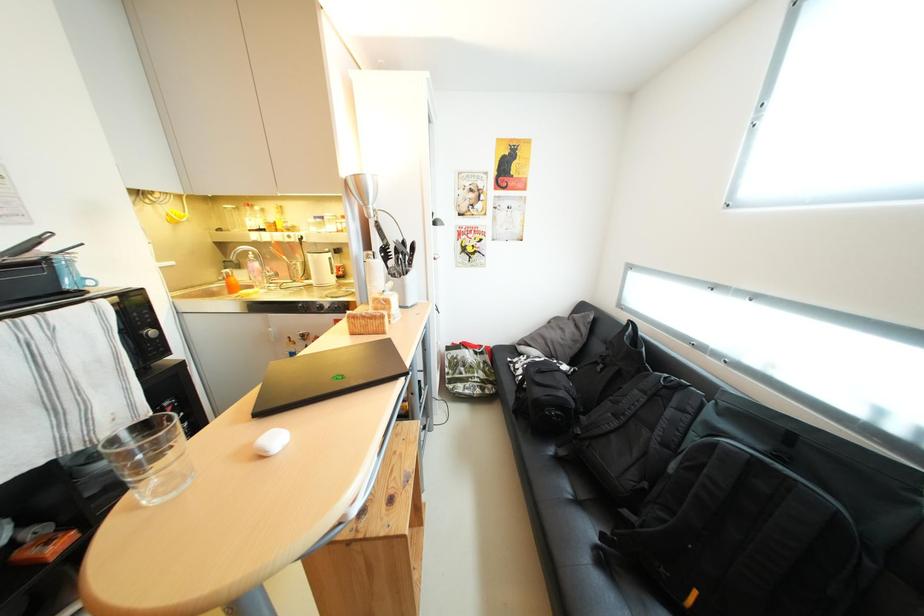
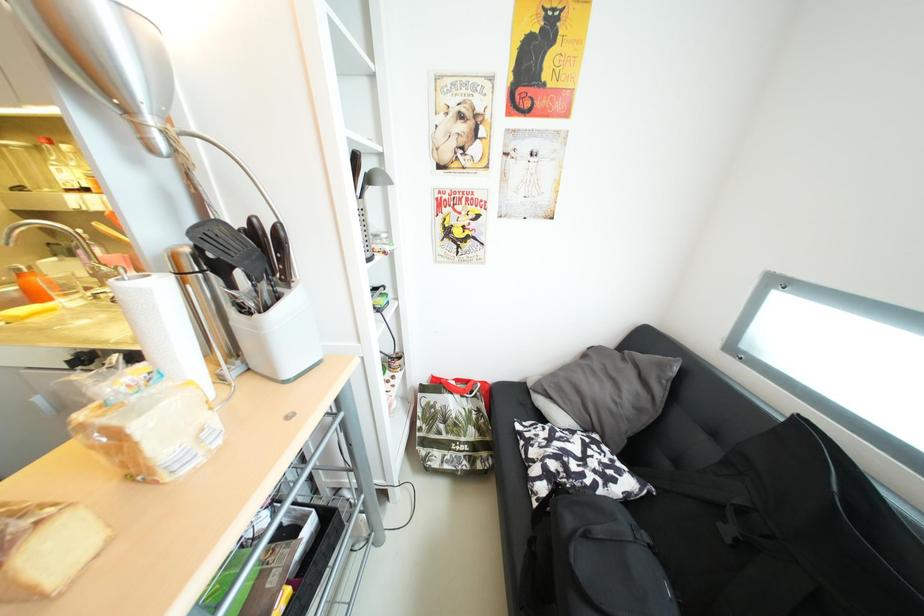
Question: Which direction would the cameraman need to move to produce the second image? Reply with the corresponding letter.

Choices:
 (A) Left
 (B) Right
 (C) Forward
 (D) Backward

Answer: (C)